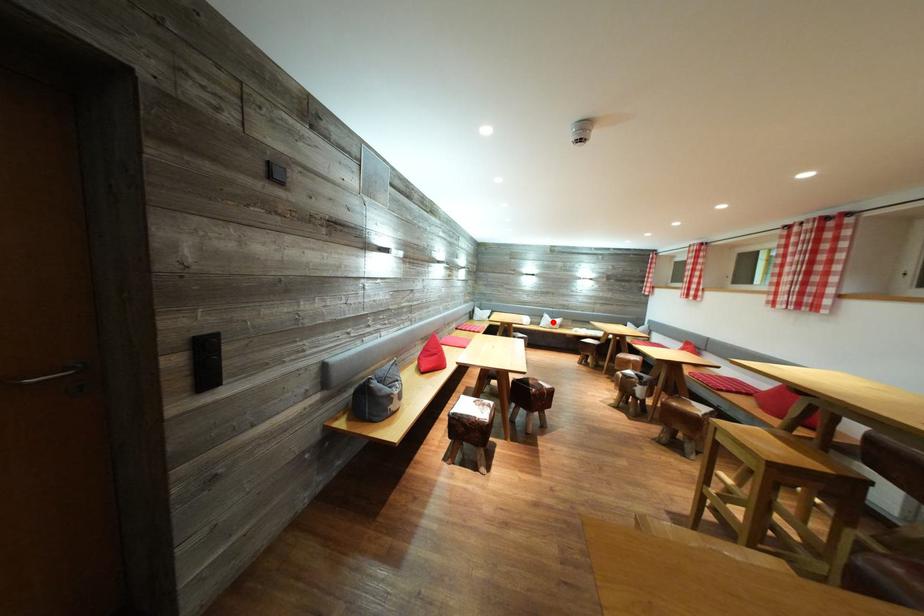
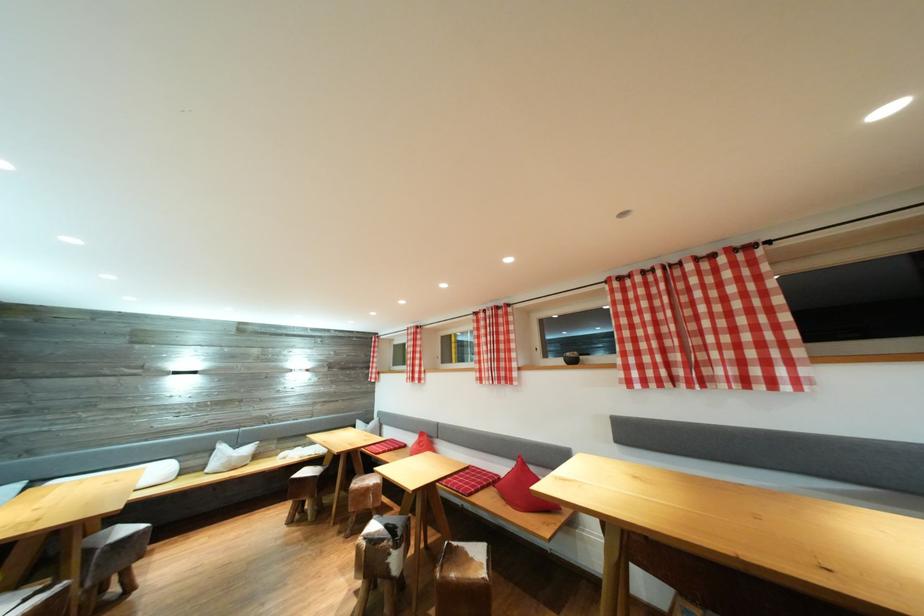
Question: I am providing you with two images of the same scene from different viewpoints. A red point is marked on the first image. Can you still see the location of the red point in image 2?

Choices:
 (A) Yes
 (B) No

Answer: (A)